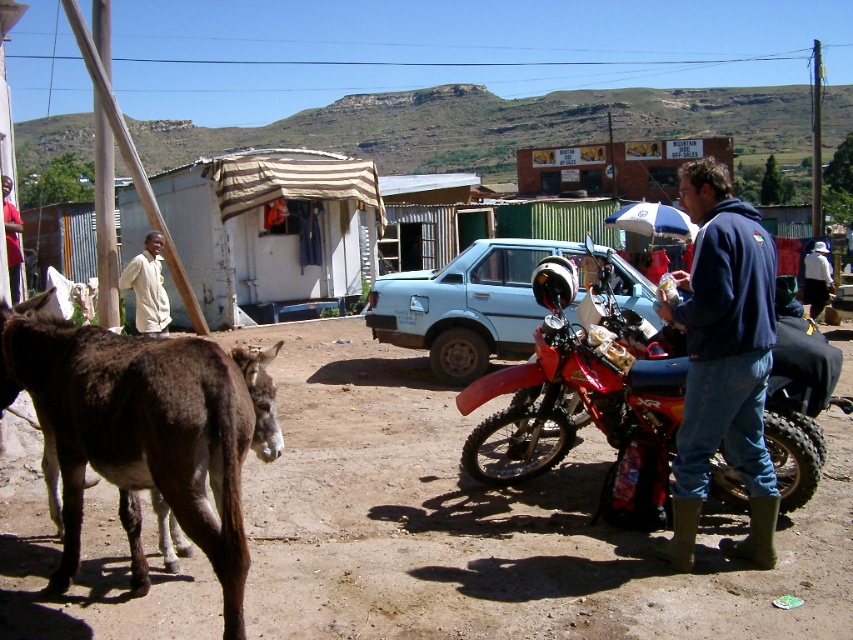
Question: Which point appears closest to the camera in this image?

Choices:
 (A) 676,460
 (B) 813,317

Answer: (A)

Question: Among these objects, which one is farthest from the camera?

Choices:
 (A) red matte dirt bike at center
 (B) light beige shirt at left
 (C) white fabric hat at upper center

Answer: (C)

Question: Does light beige shirt at left appear on the left side of brushed metal water at bottle left?

Choices:
 (A) yes
 (B) no

Answer: (B)

Question: Considering the relative positions of blue denim jacket at right and white fabric hat at upper center in the image provided, where is blue denim jacket at right located with respect to white fabric hat at upper center?

Choices:
 (A) above
 (B) below

Answer: (B)

Question: Can you confirm if brown fuzzy donkey at lower left is wider than brushed metal water at bottle left?

Choices:
 (A) yes
 (B) no

Answer: (A)

Question: Which point is farther to the camera?

Choices:
 (A) white fabric hat at upper center
 (B) brushed metal water at bottle left

Answer: (A)